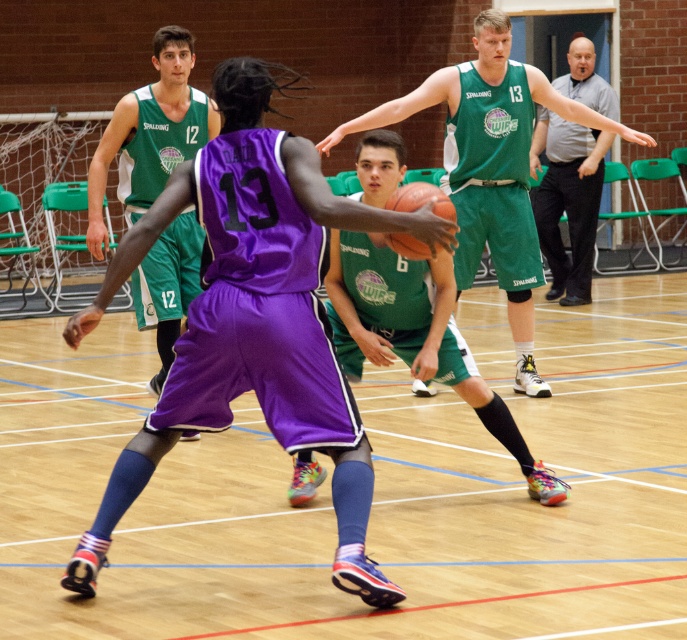
Question: Is purple matte basketball player at center to the right of orange matte basketball at center from the viewer's perspective?

Choices:
 (A) no
 (B) yes

Answer: (B)

Question: Which point is closer to the camera?

Choices:
 (A) (497, 256)
 (B) (168, 248)
 (C) (416, 209)

Answer: (C)

Question: In this image, where is green jersey at center located relative to matte green jersey at upper left?

Choices:
 (A) below
 (B) above

Answer: (A)

Question: Estimate the real-world distances between objects in this image. Which object is closer to the orange matte basketball at center?

Choices:
 (A) matte green jersey at upper left
 (B) green jersey at center

Answer: (A)

Question: Which object is positioned farthest from the purple matte basketball player at center?

Choices:
 (A) green jersey at center
 (B) orange matte basketball at center

Answer: (A)

Question: Does purple matte basketball player at center have a lesser width compared to gray casual shirt at upper right?

Choices:
 (A) no
 (B) yes

Answer: (A)